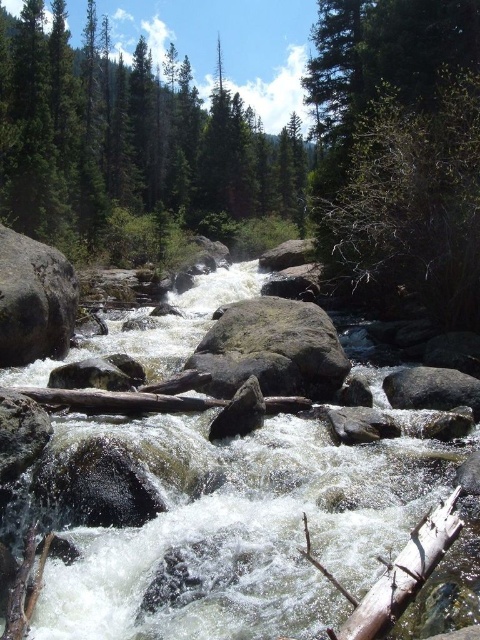
Question: Is white frothy water at center below green matte tree at upper center?

Choices:
 (A) no
 (B) yes

Answer: (B)

Question: Which point is closer to the camera?

Choices:
 (A) gray rough boulder at left
 (B) green matte tree at upper center
 (C) white frothy water at center

Answer: (C)

Question: Which object is the closest to the gray rough boulder at center?

Choices:
 (A) green matte tree at upper center
 (B) white frothy water at center

Answer: (B)

Question: Which object is closer to the camera taking this photo?

Choices:
 (A) white frothy water at center
 (B) gray rough boulder at center
 (C) gray rough boulder at left
 (D) green matte tree at upper center

Answer: (A)

Question: Can you confirm if green matte tree at upper center is positioned below gray rough boulder at center?

Choices:
 (A) yes
 (B) no

Answer: (B)

Question: Where is white frothy water at center located in relation to gray rough boulder at center in the image?

Choices:
 (A) above
 (B) below

Answer: (B)